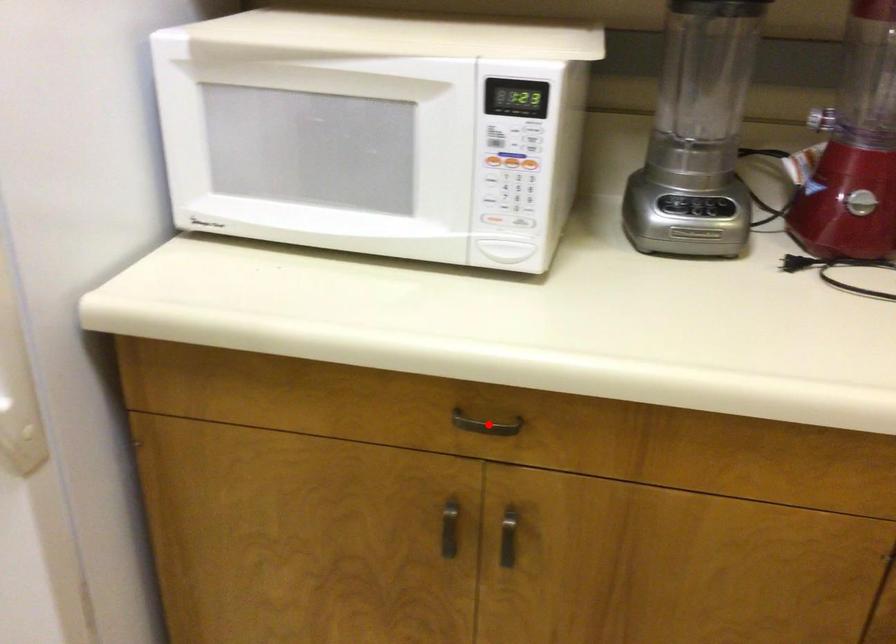
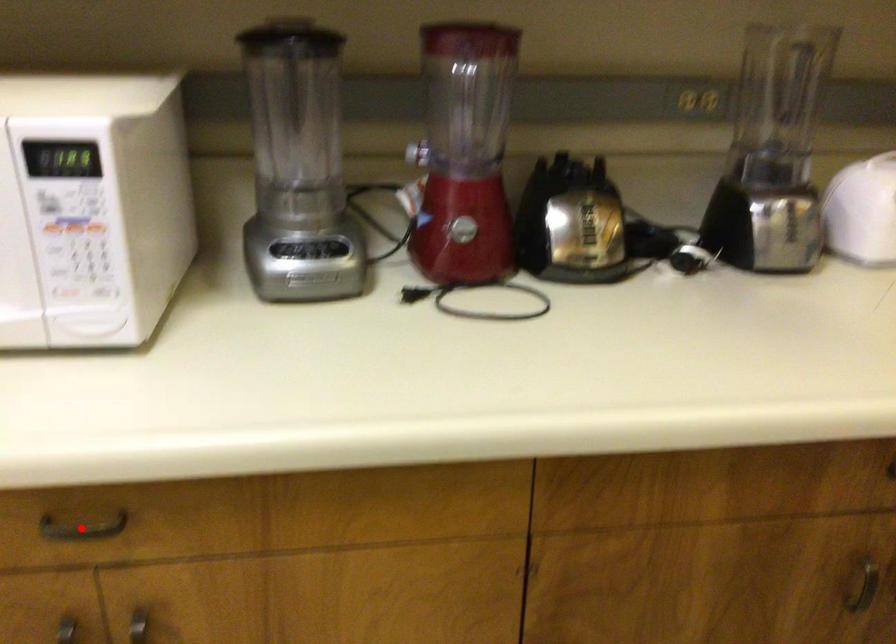
I am providing you with two images of the same scene from different viewpoints. A red point is marked on the first image and another point is marked on the second image. Are the points marked in image1 and image2 representing the same 3D position?

Yes